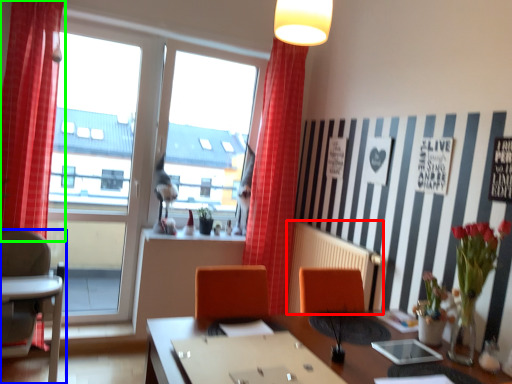
Question: Considering the real-world distances, which object is farthest from radiator (highlighted by a red box)? chair (highlighted by a blue box) or curtain (highlighted by a green box)?

Choices:
 (A) chair
 (B) curtain

Answer: (B)